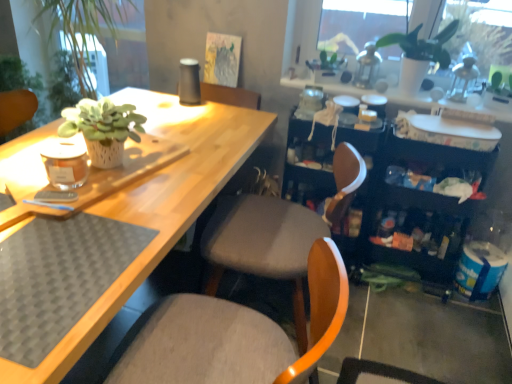
Question: Can you confirm if white matte plant pot at upper right is wider than black plastic bookshelf at right?

Choices:
 (A) no
 (B) yes

Answer: (A)

Question: Is black plastic bookshelf at right at the back of white matte plant pot at upper right?

Choices:
 (A) yes
 (B) no

Answer: (B)

Question: Does white matte plant pot at upper right have a lesser height compared to black plastic bookshelf at right?

Choices:
 (A) yes
 (B) no

Answer: (A)

Question: From the image's perspective, does white matte plant pot at upper right appear lower than black plastic bookshelf at right?

Choices:
 (A) no
 (B) yes

Answer: (A)

Question: Is white matte plant pot at upper right touching black plastic bookshelf at right?

Choices:
 (A) no
 (B) yes

Answer: (A)

Question: Based on their sizes in the image, would you say black plastic bookshelf at right is bigger or smaller than white matte plant pot at upper right?

Choices:
 (A) big
 (B) small

Answer: (A)

Question: From the image's perspective, relative to white matte plant pot at upper right, is black plastic bookshelf at right above or below?

Choices:
 (A) below
 (B) above

Answer: (A)

Question: Looking at their shapes, would you say black plastic bookshelf at right is wider or thinner than white matte plant pot at upper right?

Choices:
 (A) thin
 (B) wide

Answer: (B)

Question: Considering their positions, is black plastic bookshelf at right located in front of or behind white matte plant pot at upper right?

Choices:
 (A) front
 (B) behind

Answer: (A)

Question: From a real-world perspective, is white matte plant pot at upper right above or below black plastic bookshelf at right?

Choices:
 (A) below
 (B) above

Answer: (B)

Question: From the image's perspective, is white matte plant pot at upper right above or below black plastic bookshelf at right?

Choices:
 (A) below
 (B) above

Answer: (B)

Question: Do you think white matte plant pot at upper right is within black plastic bookshelf at right, or outside of it?

Choices:
 (A) inside
 (B) outside

Answer: (B)

Question: Would you say white matte plant pot at upper right is to the left or to the right of black plastic bookshelf at right in the picture?

Choices:
 (A) right
 (B) left

Answer: (B)

Question: Which is correct: matte gray cushioned chair at center, the 2th chair in the back-to-front sequence, is inside white matte plant pot at upper right, or outside of it?

Choices:
 (A) inside
 (B) outside

Answer: (B)

Question: From a real-world perspective, is matte gray cushioned chair at center, the 1th chair positioned from the front, physically located above or below white matte plant pot at upper right?

Choices:
 (A) below
 (B) above

Answer: (A)